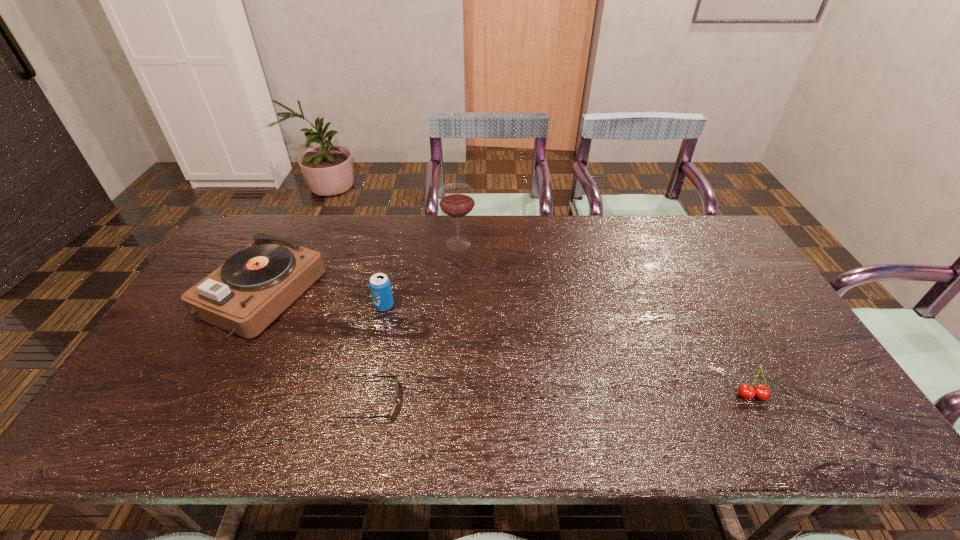
Where is `vacant space located on the front-facing side of the shortest object`? The width and height of the screenshot is (960, 540). vacant space located on the front-facing side of the shortest object is located at coordinates (450, 401).

At what (x,y) coordinates should I click in order to perform the action: click on wineglass located in the far edge section of the desktop. Please return your answer as a coordinate pair (x, y). Looking at the image, I should click on (456, 200).

The image size is (960, 540). What are the coordinates of `record player located in the far edge section of the desktop` in the screenshot? It's located at (244, 295).

The image size is (960, 540). What are the coordinates of `object that is at the near edge` in the screenshot? It's located at (390, 414).

Image resolution: width=960 pixels, height=540 pixels. In order to click on object present at the left edge in this screenshot , I will do `click(244, 295)`.

The width and height of the screenshot is (960, 540). What are the coordinates of `object that is at the far left corner` in the screenshot? It's located at (244, 295).

Find the location of a particular element. The height and width of the screenshot is (540, 960). vacant space at the far edge of the desktop is located at coordinates (452, 253).

At what (x,y) coordinates should I click in order to perform the action: click on vacant space at the near edge. Please return your answer as a coordinate pair (x, y). The height and width of the screenshot is (540, 960). Looking at the image, I should click on (641, 443).

Locate an element on the screen. Image resolution: width=960 pixels, height=540 pixels. free region at the left edge is located at coordinates (172, 374).

Find the location of a particular element. The width and height of the screenshot is (960, 540). free space at the right edge of the desktop is located at coordinates (771, 329).